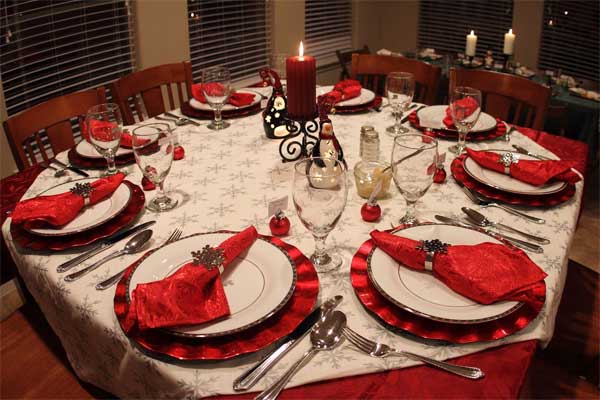
Image resolution: width=600 pixels, height=400 pixels. Identify the location of chairs at tables. (14, 339), (40, 118), (137, 89), (375, 68), (474, 85), (342, 58), (589, 321), (560, 118), (582, 84).